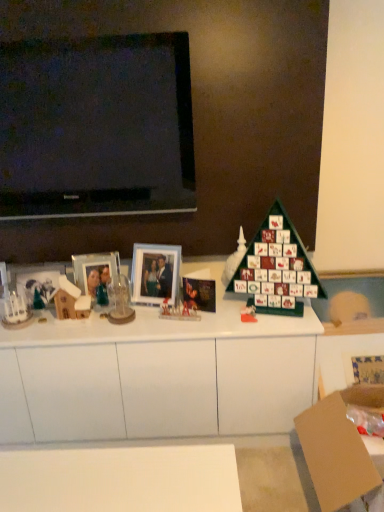
Identify the location of vacant space to the left of green matte advent calendar at right. (221, 322).